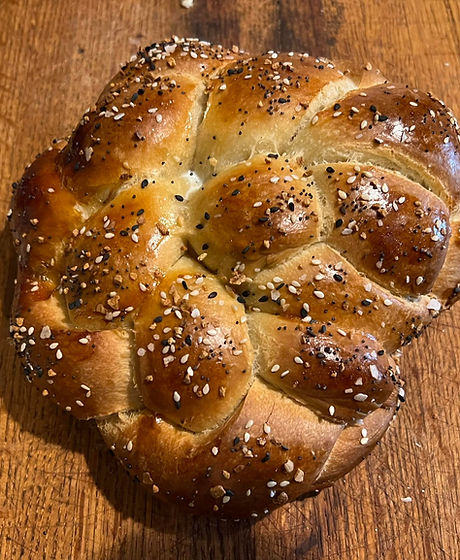
I want to click on dark shadow on bottom center edge of table, so click(280, 550), click(236, 546), click(191, 546), click(144, 548), click(121, 554).